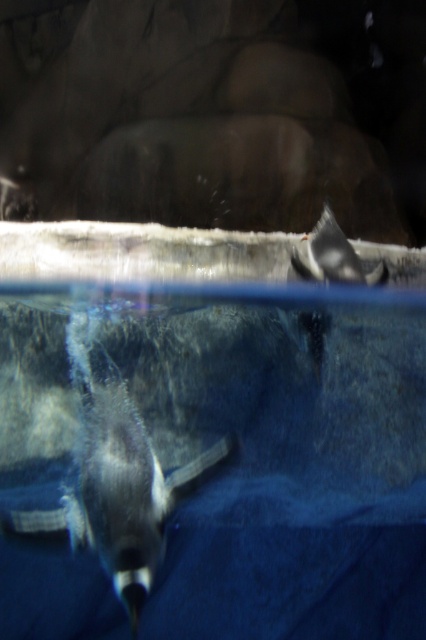
Question: Which point appears closest to the camera in this image?

Choices:
 (A) (334, 260)
 (B) (126, 488)

Answer: (B)

Question: Can you confirm if shiny black penguin at lower left is positioned above white matte penguin at upper right?

Choices:
 (A) no
 (B) yes

Answer: (A)

Question: Can you confirm if shiny black penguin at lower left is positioned below white matte penguin at upper right?

Choices:
 (A) yes
 (B) no

Answer: (A)

Question: Which point is closer to the camera taking this photo?

Choices:
 (A) (333, 260)
 (B) (135, 518)

Answer: (B)

Question: Is shiny black penguin at lower left smaller than white matte penguin at upper right?

Choices:
 (A) yes
 (B) no

Answer: (B)